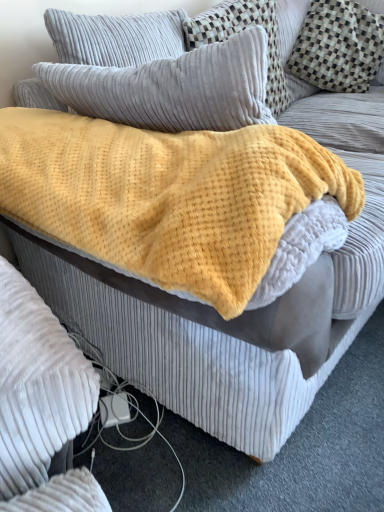
Question: Based on their sizes in the image, would you say velvety gray pillow at upper left, which appears as the 1th pillow when viewed from the left, is bigger or smaller than checkered fabric pillow at upper right, the first pillow from the right?

Choices:
 (A) small
 (B) big

Answer: (A)

Question: Considering their positions, is velvety gray pillow at upper left, which appears as the 1th pillow when viewed from the left, located in front of or behind checkered fabric pillow at upper right, the 3th pillow in the left-to-right sequence?

Choices:
 (A) front
 (B) behind

Answer: (A)

Question: Which object is positioned farthest from the velvety gray pillow at upper left, which appears as the 1th pillow when viewed from the left?

Choices:
 (A) yellow fuzzy blanket at center
 (B) checkered fabric pillow at upper right, the first pillow from the right
 (C) velvet gray pillow at upper center, the 2th pillow from the right

Answer: (B)

Question: Which of these objects is positioned closest to the yellow fuzzy blanket at center?

Choices:
 (A) velvet gray pillow at upper center, the 2th pillow from the right
 (B) checkered fabric pillow at upper right, the first pillow from the right
 (C) velvety gray pillow at upper left, which appears as the 1th pillow when viewed from the left

Answer: (C)